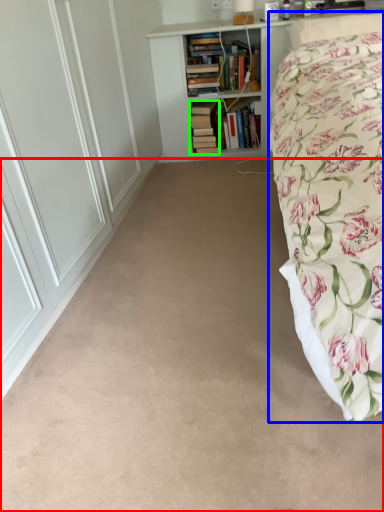
Question: Which object is positioned farthest from plain (highlighted by a red box)? Select from bed (highlighted by a blue box) and book (highlighted by a green box).

Choices:
 (A) bed
 (B) book

Answer: (B)